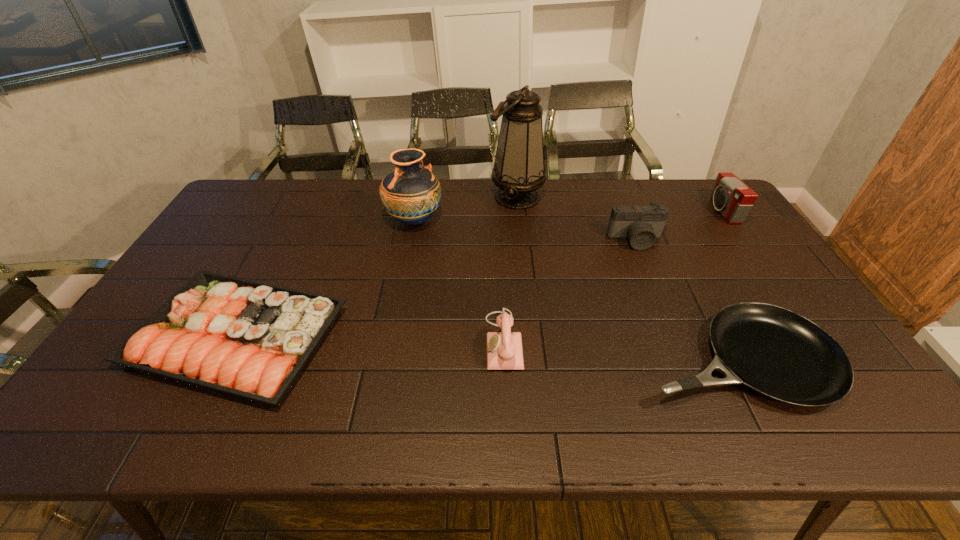
Image resolution: width=960 pixels, height=540 pixels. What are the coordinates of `the tallest object` in the screenshot? It's located at (518, 171).

Locate an element on the screen. The width and height of the screenshot is (960, 540). the sixth shortest object is located at coordinates (411, 194).

The image size is (960, 540). Identify the location of the sixth object from right to left. (411, 194).

The image size is (960, 540). In order to click on the right camera in this screenshot , I will do `click(731, 197)`.

Image resolution: width=960 pixels, height=540 pixels. In order to click on the left camera in this screenshot , I will do `click(642, 224)`.

Where is `telephone`? This screenshot has width=960, height=540. telephone is located at coordinates [x=504, y=349].

The image size is (960, 540). What are the coordinates of `pan` in the screenshot? It's located at (773, 351).

Identify the location of platter. The image size is (960, 540). click(250, 340).

The height and width of the screenshot is (540, 960). Find the location of `vacant position located 0.200m on the front of the tallest object`. vacant position located 0.200m on the front of the tallest object is located at coordinates (522, 252).

This screenshot has height=540, width=960. What are the coordinates of `vacant space located on the back of the second object from left to right` in the screenshot? It's located at (419, 196).